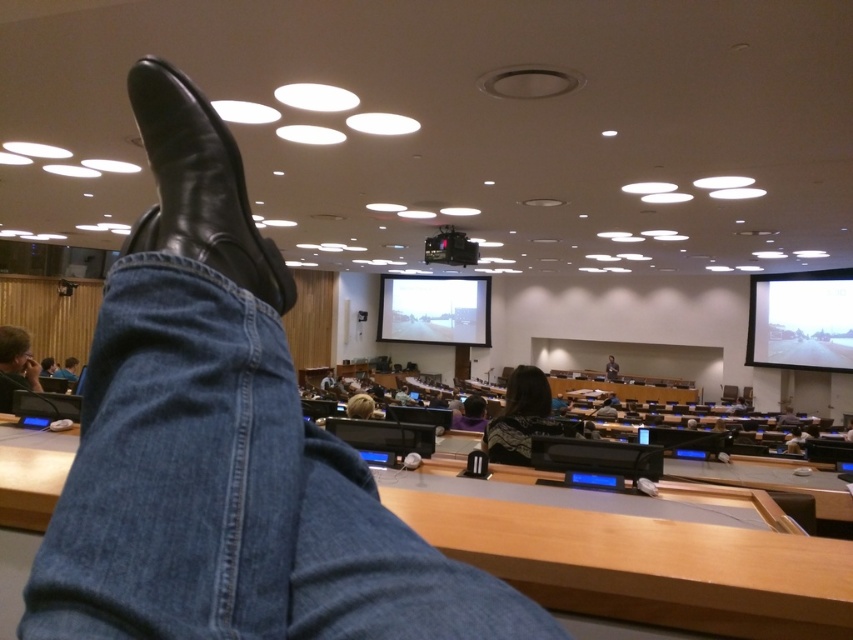
Does denim jeans at upper left have a lesser width compared to black plastic projector at upper center?

Yes.

Does denim jeans at upper left appear over black plastic projector at upper center?

No.

This screenshot has height=640, width=853. What do you see at coordinates (180, 412) in the screenshot?
I see `denim jeans at upper left` at bounding box center [180, 412].

This screenshot has height=640, width=853. In order to click on denim jeans at upper left in this screenshot , I will do `click(180, 412)`.

Between black leather boot at upper center and jeans at lower left, which one appears on the left side from the viewer's perspective?

Positioned to the left is jeans at lower left.

Does black leather boot at upper center have a greater width compared to jeans at lower left?

No, black leather boot at upper center is not wider than jeans at lower left.

Describe the element at coordinates (199, 186) in the screenshot. I see `black leather boot at upper center` at that location.

Identify the location of black leather boot at upper center. This screenshot has height=640, width=853. (199, 186).

Who is higher up, dark gray sweater at center or dark brown leather shoe at lower left?

dark gray sweater at center

Between point (503, 440) and point (611, 364), which one is positioned behind?

Point (611, 364)

Locate an element on the screen. The height and width of the screenshot is (640, 853). dark gray sweater at center is located at coordinates (521, 419).